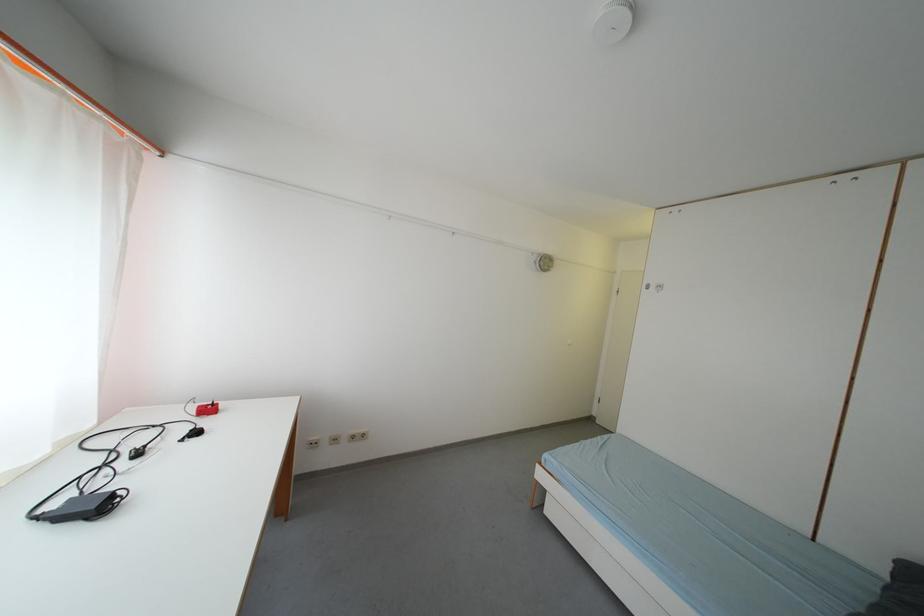
The width and height of the screenshot is (924, 616). Find the location of `black power adapter`. black power adapter is located at coordinates (103, 476).